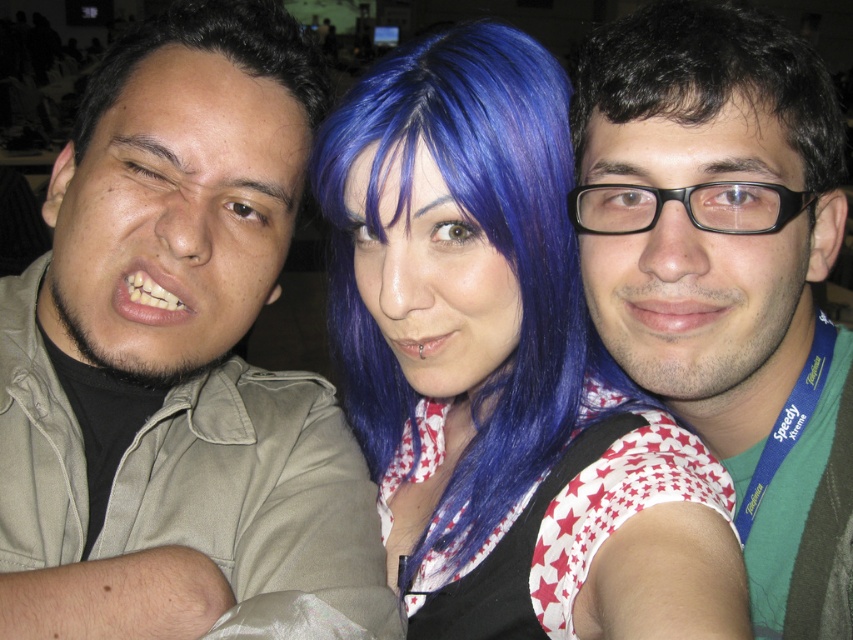
Does black matte glasses at center appear on the left side of dark brown hair at left?

Incorrect, black matte glasses at center is not on the left side of dark brown hair at left.

Can you confirm if black matte glasses at center is positioned below dark brown hair at left?

Yes.

Between point (608, 253) and point (308, 36), which one is positioned in front?

Point (608, 253)

Image resolution: width=853 pixels, height=640 pixels. In order to click on black matte glasses at center in this screenshot , I will do `click(728, 275)`.

Can you confirm if dark brown shiny hair at center is positioned to the left of dark brown hair at left?

No, dark brown shiny hair at center is not to the left of dark brown hair at left.

In the scene shown: Who is lower down, dark brown shiny hair at center or dark brown hair at left?

dark brown hair at left is lower down.

Where is `dark brown shiny hair at center`? Image resolution: width=853 pixels, height=640 pixels. dark brown shiny hair at center is located at coordinates (709, 77).

Identify the location of dark brown shiny hair at center. Image resolution: width=853 pixels, height=640 pixels. (709, 77).

Is blue hair at center further to camera compared to dark brown shiny hair at center?

No.

Between blue hair at center and dark brown shiny hair at center, which one has less height?

dark brown shiny hair at center

Is point (672, 602) positioned behind point (590, 90)?

No, (672, 602) is closer to viewer.

At what (x,y) coordinates should I click in order to perform the action: click on blue hair at center. Please return your answer as a coordinate pair (x, y). Looking at the image, I should click on (502, 368).